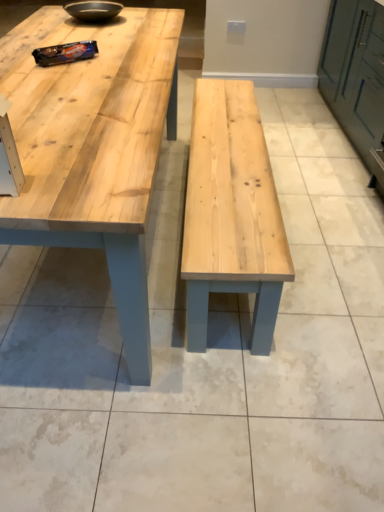
You are a GUI agent. You are given a task and a screenshot of the screen. Output one action in this format:
    pyautogui.click(x=<x>, y=<y>)
    Task: Click on the vacant area that lies in front of matte black bowl at upper center
    
    Given the screenshot: What is the action you would take?
    point(92,31)